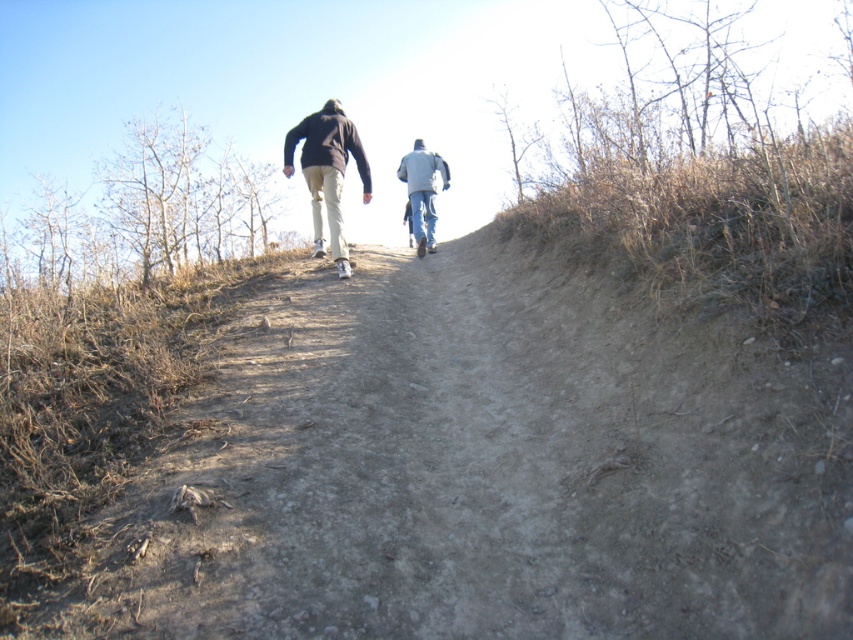
Question: Does dull gray dirt track at center have a larger size compared to dark brown hoodie at center?

Choices:
 (A) yes
 (B) no

Answer: (A)

Question: Which object is closer to the camera taking this photo?

Choices:
 (A) light blue jeans at center
 (B) dark brown hoodie at center

Answer: (B)

Question: Can you confirm if dull gray dirt track at center is wider than light blue jeans at center?

Choices:
 (A) no
 (B) yes

Answer: (B)

Question: Which of the following is the closest to the observer?

Choices:
 (A) (514, 525)
 (B) (419, 166)

Answer: (A)

Question: Which object appears closest to the camera in this image?

Choices:
 (A) dark brown hoodie at center
 (B) light blue jeans at center
 (C) dull gray dirt track at center

Answer: (C)

Question: Is dark brown hoodie at center wider than light blue jeans at center?

Choices:
 (A) yes
 (B) no

Answer: (A)